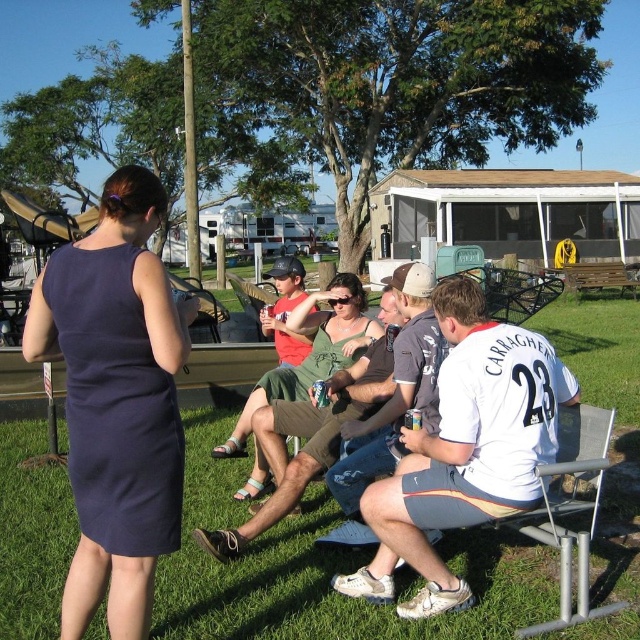
In the scene shown: You are a photographer positioned at the edge of the grassy lawn. You want to take a photo that includes both the white jersey at center and the green fabric dress at center. What is the minimum distance you need to move backward to ensure both are fully in frame?

The white jersey at center is 1.66 meters from the green fabric dress at center. To capture both in the same frame, you need to move back at least 1.66 meters to ensure both are within the camera view.

You are a photographer trying to capture a photo of the white jersey at center and the navy blue fabric dress at left. Which object should you focus on first to ensure both are in the frame?

You should focus on the white jersey at center first since it is closer to the viewer than the navy blue fabric dress at left, ensuring both are in the frame.